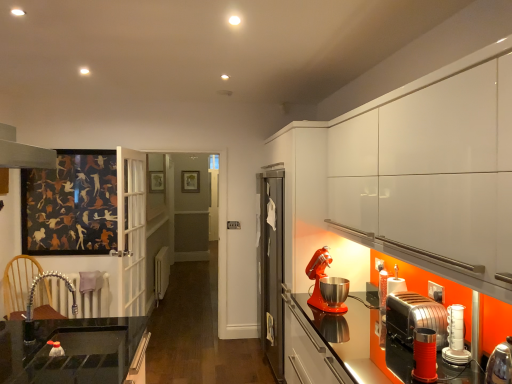
At what (x,y) coordinates should I click in order to perform the action: click on vacant space situated above polished chrome toaster at lower right, which is the third kitchen appliance in front-to-back order (from a real-world perspective). Please return your answer as a coordinate pair (x, y). The image size is (512, 384). Looking at the image, I should click on (422, 304).